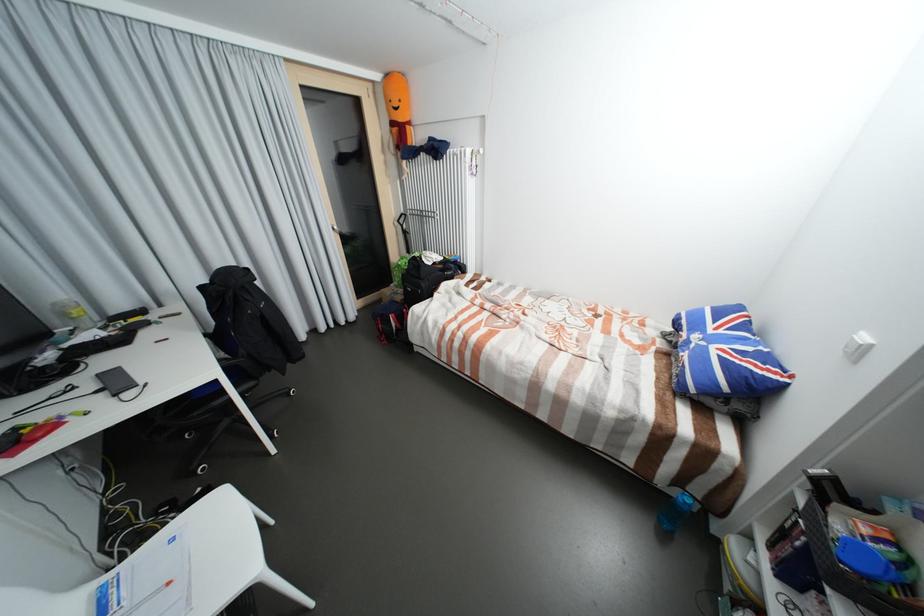
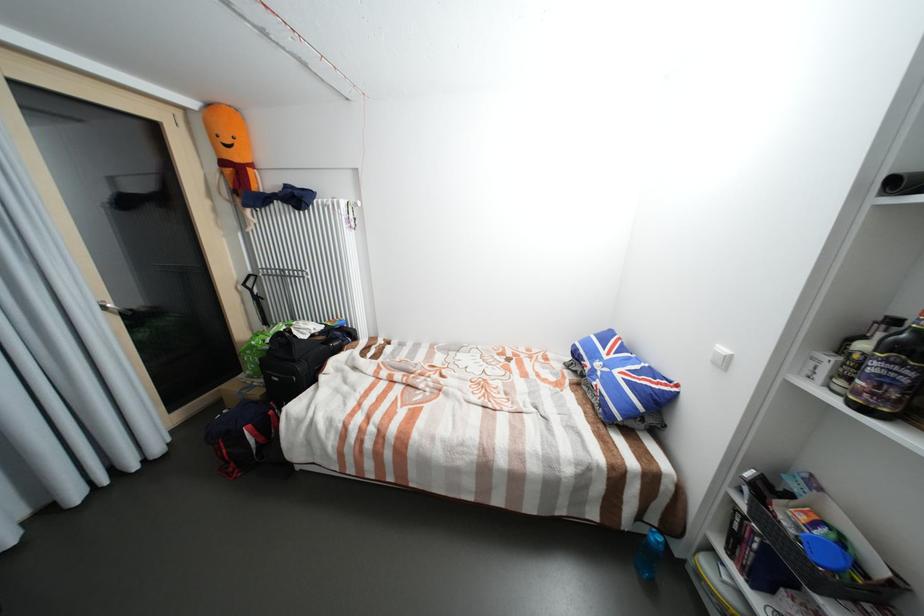
The point at (x=438, y=259) is marked in the first image. Where is the corresponding point in the second image?

(313, 330)